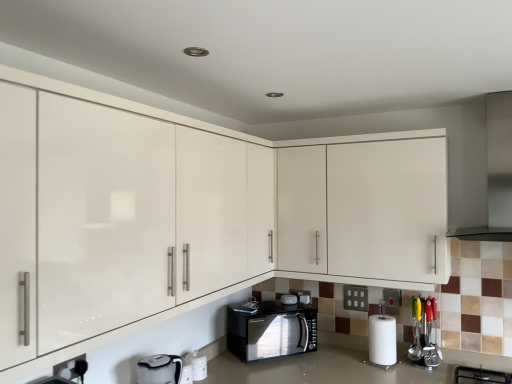
Image resolution: width=512 pixels, height=384 pixels. In order to click on black matte gas stove at lower right in this screenshot , I will do `click(481, 375)`.

Image resolution: width=512 pixels, height=384 pixels. What are the coordinates of `white glossy container at lower center, marked as the 4th appliance in a back-to-front arrangement` in the screenshot? It's located at (197, 365).

The height and width of the screenshot is (384, 512). What do you see at coordinates (496, 172) in the screenshot?
I see `satin silver exhaust hood at upper right` at bounding box center [496, 172].

The height and width of the screenshot is (384, 512). What do you see at coordinates (382, 340) in the screenshot?
I see `white matte paper towel at lower right` at bounding box center [382, 340].

The image size is (512, 384). In order to click on matte white cabinets at center, which ranks as the 1th cabinetry in front-to-back order in this screenshot , I will do `click(207, 213)`.

You are a GUI agent. You are given a task and a screenshot of the screen. Output one action in this format:
    pyautogui.click(x=<x>, y=<y>)
    Task: Click on the black matte gas stove at lower right
    
    Given the screenshot: What is the action you would take?
    pyautogui.click(x=481, y=375)

Based on their sizes in the image, would you say white glossy cabinet at upper center, the second cabinetry from the front, is bigger or smaller than satin silver exhaust hood at upper right?

Clearly, white glossy cabinet at upper center, the second cabinetry from the front, is larger in size than satin silver exhaust hood at upper right.

Considering the positions of point (418, 228) and point (458, 236), is point (418, 228) closer or farther from the camera than point (458, 236)?

Point (418, 228) appears to be closer to the viewer than point (458, 236).

Based on the photo, can you confirm if white glossy cabinet at upper center, which is the first cabinetry in back-to-front order, is positioned to the right of satin silver exhaust hood at upper right?

In fact, white glossy cabinet at upper center, which is the first cabinetry in back-to-front order, is to the left of satin silver exhaust hood at upper right.

Is white glossy cabinet at upper center, the second cabinetry from the front, positioned with its back to satin silver exhaust hood at upper right?

That's not correct — white glossy cabinet at upper center, the second cabinetry from the front, is not looking away from satin silver exhaust hood at upper right.

Considering the positions of point (375, 351) and point (431, 324), is point (375, 351) closer or farther from the camera than point (431, 324)?

Point (375, 351) is farther from the camera than point (431, 324).

What's the angular difference between white matte paper towel at lower right and metallic silver utensils at right, the 4th appliance when ordered from left to right,'s facing directions?

0.779 degrees.

Consider the image. Considering the positions of objects white matte paper towel at lower right and metallic silver utensils at right, acting as the 1th appliance starting from the right, in the image provided, who is behind, white matte paper towel at lower right or metallic silver utensils at right, acting as the 1th appliance starting from the right,?

metallic silver utensils at right, acting as the 1th appliance starting from the right, is more distant.

Is white matte paper towel at lower right facing away from metallic silver utensils at right, the 4th appliance when ordered from left to right?

No, white matte paper towel at lower right's orientation is not away from metallic silver utensils at right, the 4th appliance when ordered from left to right.

Starting from the black matte gas stove at lower right, which appliance is the 1st one behind? Please provide its 2D coordinates.

[(197, 365)]

Consider the image. Are white glossy container at lower center, which is counted as the fourth appliance, starting from the right, and black matte gas stove at lower right making contact?

They are not placed beside each other.

Is white glossy container at lower center, placed as the 1th appliance when sorted from left to right, positioned in front of black matte gas stove at lower right?

No.

From the image's perspective, is white glossy container at lower center, placed as the 1th appliance when sorted from left to right, above or below black matte gas stove at lower right?

Based on their image positions, white glossy container at lower center, placed as the 1th appliance when sorted from left to right, is located above black matte gas stove at lower right.

Would you say black matte gas stove at lower right contains matte white cabinets at center, which ranks as the 1th cabinetry in front-to-back order?

Actually, matte white cabinets at center, which ranks as the 1th cabinetry in front-to-back order, is outside black matte gas stove at lower right.

Is black matte gas stove at lower right at the left side of matte white cabinets at center, which ranks as the 1th cabinetry in front-to-back order?

In fact, black matte gas stove at lower right is to the right of matte white cabinets at center, which ranks as the 1th cabinetry in front-to-back order.

From their relative heights in the image, would you say black matte gas stove at lower right is taller or shorter than matte white cabinets at center, which ranks as the 1th cabinetry in front-to-back order?

black matte gas stove at lower right is shorter than matte white cabinets at center, which ranks as the 1th cabinetry in front-to-back order.

From a real-world perspective, which is physically below, black matte gas stove at lower right or matte white cabinets at center, marked as the 2th cabinetry in a back-to-front arrangement?

In real-world perspective, black matte gas stove at lower right is lower.

Considering the sizes of objects white matte paper towel at lower right and black glossy microwave at center in the image provided, who is smaller, white matte paper towel at lower right or black glossy microwave at center?

Smaller between the two is white matte paper towel at lower right.

From a real-world perspective, does white matte paper towel at lower right sit lower than black glossy microwave at center?

Indeed, from a real-world perspective, white matte paper towel at lower right is positioned beneath black glossy microwave at center.

Between white matte paper towel at lower right and black glossy microwave at center, which one has less height?

white matte paper towel at lower right.

Find the location of `paper towel on the right of black glossy microwave at center`. paper towel on the right of black glossy microwave at center is located at coordinates (382, 340).

From a real-world perspective, who is located lower, satin silver exhaust hood at upper right or black glossy microwave at center, positioned as the 2th appliance in right-to-left order?

black glossy microwave at center, positioned as the 2th appliance in right-to-left order, is physically lower.

Is satin silver exhaust hood at upper right beside black glossy microwave at center, which ranks as the first appliance in back-to-front order?

No, satin silver exhaust hood at upper right is not touching black glossy microwave at center, which ranks as the first appliance in back-to-front order.

Does satin silver exhaust hood at upper right come behind black glossy microwave at center, the 3th appliance positioned from the left?

That is False.

From the satin silver exhaust hood at upper right, count 4th appliances backward and point to it. Please provide its 2D coordinates.

[(302, 296)]

What are the coordinates of `gas stove below the black glossy microwave at lower center, the 2th appliance in the left-to-right sequence (from a real-world perspective)` in the screenshot? It's located at (481, 375).

Could you measure the distance between black matte gas stove at lower right and black glossy microwave at lower center, the 3th appliance from the front?

black matte gas stove at lower right and black glossy microwave at lower center, the 3th appliance from the front, are 39.12 inches apart.

Does black matte gas stove at lower right have a greater width compared to black glossy microwave at lower center, the 3th appliance from the front?

Correct, the width of black matte gas stove at lower right exceeds that of black glossy microwave at lower center, the 3th appliance from the front.

Which point is more distant from viewer, (456, 370) or (283, 303)?

Positioned behind is point (283, 303).

Find the location of a particular element. The image size is (512, 384). the 1st cabinetry counting from the left of the satin silver exhaust hood at upper right is located at coordinates (365, 209).

Find the location of a particular element. appliance on the right of white matte paper towel at lower right is located at coordinates (424, 332).

Looking at the image, which one is located closer to black glossy microwave at center, which ranks as the first appliance in back-to-front order, black glossy microwave at center or matte white cabinets at center, marked as the 2th cabinetry in a back-to-front arrangement?

Among the two, black glossy microwave at center is located nearer to black glossy microwave at center, which ranks as the first appliance in back-to-front order.

Consider the image. Which object lies nearer to the anchor point metallic silver utensils at right, which is the third appliance in back-to-front order, black glossy microwave at lower center, acting as the third appliance starting from the right, or matte white cabinets at center, which ranks as the 1th cabinetry in front-to-back order?

black glossy microwave at lower center, acting as the third appliance starting from the right, lies closer to metallic silver utensils at right, which is the third appliance in back-to-front order, than the other object.

Considering their positions, is white glossy container at lower center, marked as the 4th appliance in a back-to-front arrangement, positioned further to black matte gas stove at lower right than satin silver exhaust hood at upper right?

white glossy container at lower center, marked as the 4th appliance in a back-to-front arrangement.

Looking at the image, which one is located further to matte white cabinets at center, marked as the 2th cabinetry in a back-to-front arrangement, satin silver exhaust hood at upper right or white glossy container at lower center, placed as the 1th appliance when sorted from left to right?

The object further to matte white cabinets at center, marked as the 2th cabinetry in a back-to-front arrangement, is satin silver exhaust hood at upper right.

Which object lies nearer to the anchor point white glossy cabinet at upper center, the second cabinetry from the front, metallic silver utensils at right, acting as the 1th appliance starting from the right, or black glossy microwave at center, the 3th appliance positioned from the left?

metallic silver utensils at right, acting as the 1th appliance starting from the right, is closer to white glossy cabinet at upper center, the second cabinetry from the front.

Considering their positions, is black matte gas stove at lower right positioned closer to satin silver exhaust hood at upper right than white matte paper towel at lower right?

Based on the image, white matte paper towel at lower right appears to be nearer to satin silver exhaust hood at upper right.

Looking at the image, which one is located further to white glossy container at lower center, which is counted as the fourth appliance, starting from the right, black glossy microwave at lower center, acting as the third appliance starting from the right, or matte white cabinets at center, which ranks as the 1th cabinetry in front-to-back order?

The object further to white glossy container at lower center, which is counted as the fourth appliance, starting from the right, is matte white cabinets at center, which ranks as the 1th cabinetry in front-to-back order.

Considering their positions, is satin silver exhaust hood at upper right positioned further to black glossy microwave at lower center, acting as the third appliance starting from the right, than metallic silver utensils at right, the 4th appliance when ordered from left to right?

satin silver exhaust hood at upper right is further to black glossy microwave at lower center, acting as the third appliance starting from the right.

Identify the location of appliance between white glossy container at lower center, placed as the 1th appliance when sorted from left to right, and black glossy microwave at center, the 3th appliance positioned from the left. The height and width of the screenshot is (384, 512). (289, 299).

The image size is (512, 384). Find the location of `exhaust hood located between matte white cabinets at center, marked as the 2th cabinetry in a back-to-front arrangement, and metallic silver utensils at right, which is the third appliance in back-to-front order, in the depth direction`. exhaust hood located between matte white cabinets at center, marked as the 2th cabinetry in a back-to-front arrangement, and metallic silver utensils at right, which is the third appliance in back-to-front order, in the depth direction is located at coordinates (496, 172).

Where is `home appliance located between white glossy container at lower center, marked as the 4th appliance in a back-to-front arrangement, and black matte gas stove at lower right in the left-right direction`? This screenshot has height=384, width=512. home appliance located between white glossy container at lower center, marked as the 4th appliance in a back-to-front arrangement, and black matte gas stove at lower right in the left-right direction is located at coordinates (271, 330).

Locate an element on the screen. paper towel between black matte gas stove at lower right and black glossy microwave at center, the 4th appliance viewed from the front, in the front-back direction is located at coordinates (382, 340).